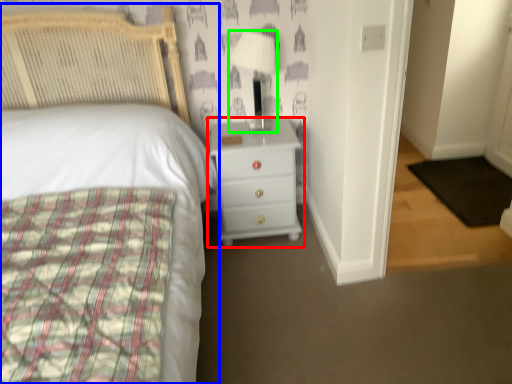
Question: Based on their relative distances, which object is nearer to chest of drawers (highlighted by a red box)? Choose from bed (highlighted by a blue box) and lamp (highlighted by a green box).

Choices:
 (A) bed
 (B) lamp

Answer: (A)